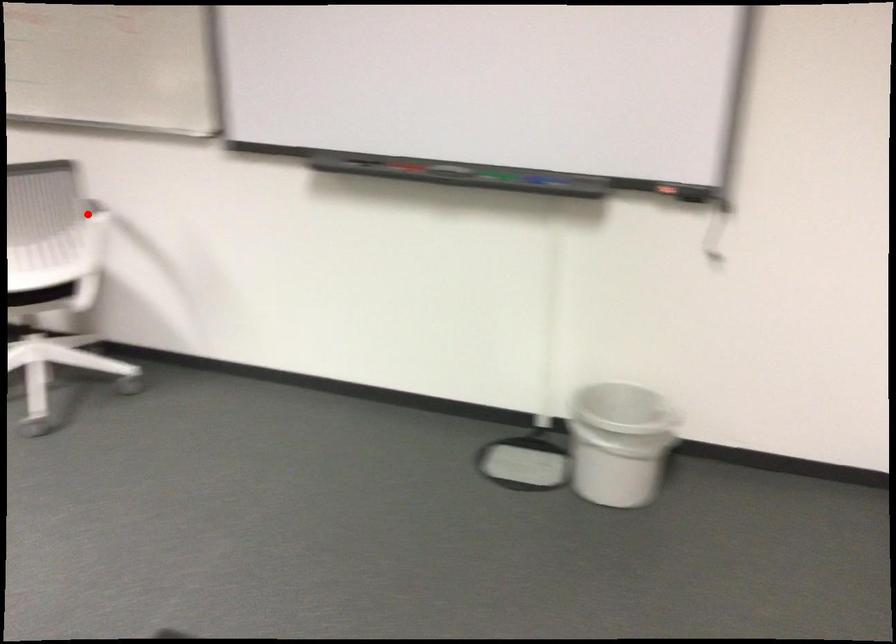
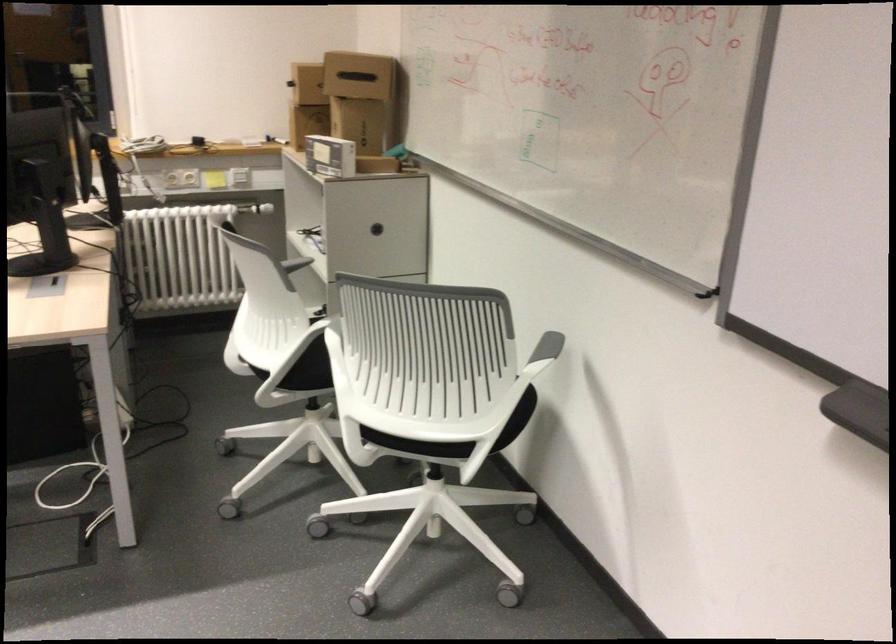
Find the pixel in the second image that matches the highlighted location in the first image.

(547, 346)